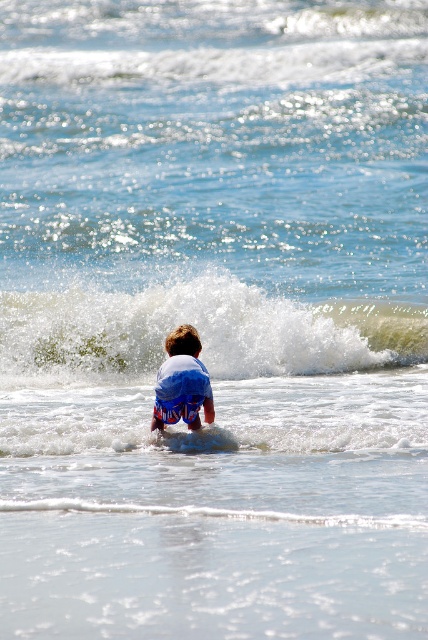
Question: Which object is the farthest from the white frothy wave at center?

Choices:
 (A) smooth blue surfboard at center
 (B) blue cotton shorts at center

Answer: (A)

Question: Among these points, which one is nearest to the camera?

Choices:
 (A) (181, 396)
 (B) (400, 333)
 (C) (213, 445)

Answer: (C)

Question: Is blue cotton shorts at center closer to the viewer compared to smooth blue surfboard at center?

Choices:
 (A) no
 (B) yes

Answer: (A)

Question: Can you confirm if blue cotton shorts at center is bigger than smooth blue surfboard at center?

Choices:
 (A) no
 (B) yes

Answer: (B)

Question: Estimate the real-world distances between objects in this image. Which object is closer to the blue cotton shorts at center?

Choices:
 (A) white frothy wave at center
 (B) smooth blue surfboard at center

Answer: (B)

Question: Can you confirm if blue cotton shorts at center is positioned above smooth blue surfboard at center?

Choices:
 (A) yes
 (B) no

Answer: (A)